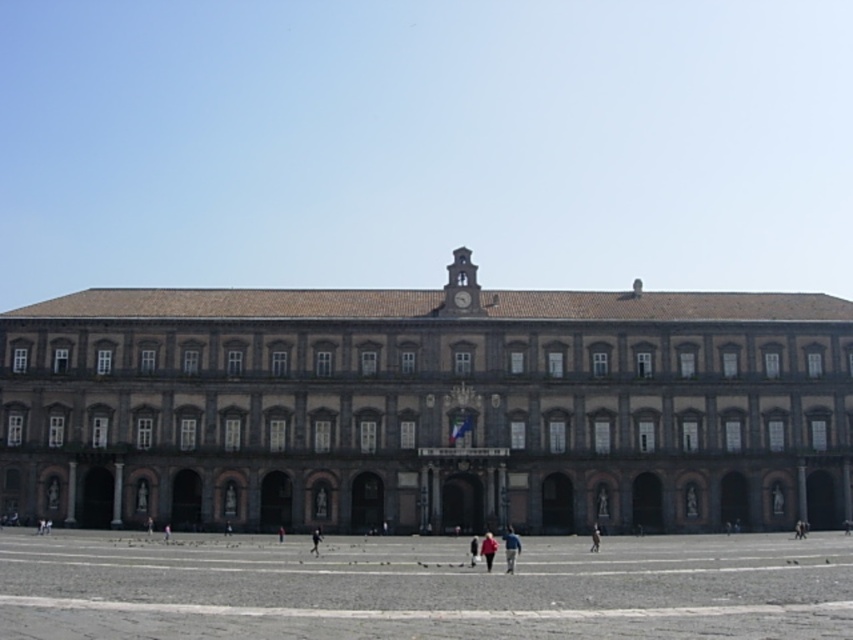
Measure the distance from red fabric person at center to dark brown leather jacket at center.

11.41 meters

Does red fabric person at center appear on the left side of dark brown leather jacket at center?

Indeed, red fabric person at center is positioned on the left side of dark brown leather jacket at center.

Between point (495, 545) and point (592, 525), which one is positioned behind?

Positioned behind is point (592, 525).

I want to click on red fabric person at center, so click(x=488, y=548).

Is the position of blue denim jeans at center less distant than that of dark blue jeans at center?

Yes, it is in front of dark blue jeans at center.

Does blue denim jeans at center come behind dark blue jeans at center?

No, blue denim jeans at center is in front of dark blue jeans at center.

Describe the element at coordinates (509, 548) in the screenshot. I see `blue denim jeans at center` at that location.

Where is `blue denim jeans at center`? Image resolution: width=853 pixels, height=640 pixels. blue denim jeans at center is located at coordinates (509, 548).

How distant is brown stone building at center from dark blue jeans at center?

They are 70.27 feet apart.

Is brown stone building at center taller than dark blue jeans at center?

Indeed, brown stone building at center has a greater height compared to dark blue jeans at center.

Does point (445, 292) lie in front of point (469, 563)?

No, (445, 292) is behind (469, 563).

Identify the location of brown stone building at center. (428, 408).